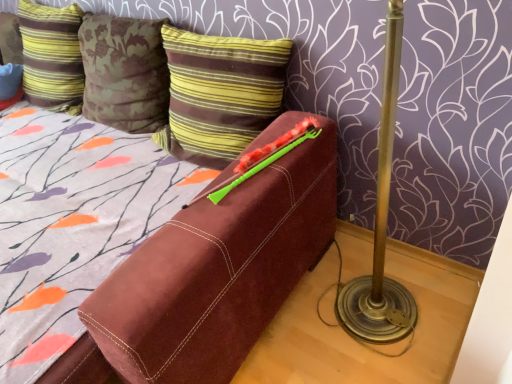
What do you see at coordinates (220, 94) in the screenshot? Image resolution: width=512 pixels, height=384 pixels. I see `brown striped pillow at upper center, the second pillow in the left-to-right sequence` at bounding box center [220, 94].

You are a GUI agent. You are given a task and a screenshot of the screen. Output one action in this format:
    pyautogui.click(x=<x>, y=<y>)
    Task: Click on the green plastic crayon at upper center
    The width and height of the screenshot is (512, 384).
    Given the screenshot: What is the action you would take?
    tap(268, 155)

How different are the orientations of brown striped pillow at upper center, which is the first pillow from right to left, and striped velvet pillow at upper left, which is the second pillow from right to left, in degrees?

The angular difference between brown striped pillow at upper center, which is the first pillow from right to left, and striped velvet pillow at upper left, which is the second pillow from right to left, is 0.000268 degrees.

Is brown striped pillow at upper center, the second pillow in the left-to-right sequence, in front of or behind striped velvet pillow at upper left, which is the second pillow from right to left, in the image?

Clearly, brown striped pillow at upper center, the second pillow in the left-to-right sequence, is in front of striped velvet pillow at upper left, which is the second pillow from right to left.

Does brown striped pillow at upper center, the second pillow in the left-to-right sequence, have a larger size compared to striped velvet pillow at upper left, which is the second pillow from right to left?

Actually, brown striped pillow at upper center, the second pillow in the left-to-right sequence, might be smaller than striped velvet pillow at upper left, which is the second pillow from right to left.

How far apart are brown striped pillow at upper center, the second pillow in the left-to-right sequence, and striped velvet pillow at upper left, which ranks as the 1th pillow in left-to-right order?

They are 30.31 inches apart.

Considering their positions, is striped velvet pillow at upper left, which ranks as the 1th pillow in left-to-right order, located in front of or behind brown striped pillow at upper center, which is the first pillow from right to left?

In the image, striped velvet pillow at upper left, which ranks as the 1th pillow in left-to-right order, appears behind brown striped pillow at upper center, which is the first pillow from right to left.

Does striped velvet pillow at upper left, which ranks as the 1th pillow in left-to-right order, contain brown striped pillow at upper center, which is the first pillow from right to left?

No, brown striped pillow at upper center, which is the first pillow from right to left, is not inside striped velvet pillow at upper left, which ranks as the 1th pillow in left-to-right order.

From the image's perspective, is striped velvet pillow at upper left, which is the second pillow from right to left, above or below brown striped pillow at upper center, which is the first pillow from right to left?

Based on their image positions, striped velvet pillow at upper left, which is the second pillow from right to left, is located above brown striped pillow at upper center, which is the first pillow from right to left.

Looking at this image, from the image's perspective, relative to brown striped pillow at upper center, which is the first pillow from right to left, is green plastic crayon at upper center above or below?

Clearly, from the image's perspective, green plastic crayon at upper center is below brown striped pillow at upper center, which is the first pillow from right to left.

In the scene shown: Who is shorter, green plastic crayon at upper center or brown striped pillow at upper center, which is the first pillow from right to left?

green plastic crayon at upper center is shorter.

From a real-world perspective, is green plastic crayon at upper center physically above brown striped pillow at upper center, which is the first pillow from right to left?

No, from a real-world perspective, green plastic crayon at upper center is not above brown striped pillow at upper center, which is the first pillow from right to left.

Considering the positions of objects green plastic crayon at upper center and brown striped pillow at upper center, which is the first pillow from right to left, in the image provided, who is more to the left, green plastic crayon at upper center or brown striped pillow at upper center, which is the first pillow from right to left,?

Positioned to the left is brown striped pillow at upper center, which is the first pillow from right to left.

Is brown striped pillow at upper center, which is the first pillow from right to left, situated inside green plastic crayon at upper center or outside?

brown striped pillow at upper center, which is the first pillow from right to left, is located beyond the bounds of green plastic crayon at upper center.

Considering the sizes of brown striped pillow at upper center, the second pillow in the left-to-right sequence, and green plastic crayon at upper center in the image, is brown striped pillow at upper center, the second pillow in the left-to-right sequence, bigger or smaller than green plastic crayon at upper center?

brown striped pillow at upper center, the second pillow in the left-to-right sequence, is bigger than green plastic crayon at upper center.

Is brown striped pillow at upper center, the second pillow in the left-to-right sequence, next to green plastic crayon at upper center?

No, brown striped pillow at upper center, the second pillow in the left-to-right sequence, is not making contact with green plastic crayon at upper center.

Does green plastic crayon at upper center have a greater width compared to striped velvet pillow at upper left, which is the second pillow from right to left?

Yes.

Are green plastic crayon at upper center and striped velvet pillow at upper left, which is the second pillow from right to left, beside each other?

No, green plastic crayon at upper center is not touching striped velvet pillow at upper left, which is the second pillow from right to left.

Does point (287, 151) lie in front of point (81, 67)?

Yes, point (287, 151) is in front of point (81, 67).

From a real-world perspective, is green plastic crayon at upper center above or below striped velvet pillow at upper left, which is the second pillow from right to left?

From a real-world perspective, green plastic crayon at upper center is physically below striped velvet pillow at upper left, which is the second pillow from right to left.

From a real-world perspective, is striped velvet pillow at upper left, which is the second pillow from right to left, located beneath green plastic crayon at upper center?

No, from a real-world perspective, striped velvet pillow at upper left, which is the second pillow from right to left, is not beneath green plastic crayon at upper center.

Consider the image. Does striped velvet pillow at upper left, which is the second pillow from right to left, have a lesser width compared to green plastic crayon at upper center?

Indeed, striped velvet pillow at upper left, which is the second pillow from right to left, has a lesser width compared to green plastic crayon at upper center.

Is striped velvet pillow at upper left, which is the second pillow from right to left, closer to the viewer compared to green plastic crayon at upper center?

No, striped velvet pillow at upper left, which is the second pillow from right to left, is further to the viewer.

Locate an element on the screen. The width and height of the screenshot is (512, 384). pillow behind the brown striped pillow at upper center, which is the first pillow from right to left is located at coordinates (52, 56).

At what (x,y) coordinates should I click in order to perform the action: click on pillow below the striped velvet pillow at upper left, which ranks as the 1th pillow in left-to-right order (from the image's perspective). Please return your answer as a coordinate pair (x, y). Looking at the image, I should click on (220, 94).

Based on their spatial positions, is green plastic crayon at upper center or striped velvet pillow at upper left, which ranks as the 1th pillow in left-to-right order, closer to brown striped pillow at upper center, which is the first pillow from right to left?

Among the two, green plastic crayon at upper center is located nearer to brown striped pillow at upper center, which is the first pillow from right to left.

Based on their spatial positions, is brown striped pillow at upper center, the second pillow in the left-to-right sequence, or striped velvet pillow at upper left, which is the second pillow from right to left, closer to green plastic crayon at upper center?

brown striped pillow at upper center, the second pillow in the left-to-right sequence, is closer to green plastic crayon at upper center.

When comparing their distances from brown striped pillow at upper center, which is the first pillow from right to left, does striped velvet pillow at upper left, which is the second pillow from right to left, or green plastic crayon at upper center seem further?

striped velvet pillow at upper left, which is the second pillow from right to left.

When comparing their distances from striped velvet pillow at upper left, which ranks as the 1th pillow in left-to-right order, does brown striped pillow at upper center, the second pillow in the left-to-right sequence, or green plastic crayon at upper center seem further?

green plastic crayon at upper center.

Looking at the image, which one is located further to green plastic crayon at upper center, striped velvet pillow at upper left, which ranks as the 1th pillow in left-to-right order, or brown striped pillow at upper center, which is the first pillow from right to left?

striped velvet pillow at upper left, which ranks as the 1th pillow in left-to-right order, is positioned further to the anchor green plastic crayon at upper center.

When comparing their distances from striped velvet pillow at upper left, which ranks as the 1th pillow in left-to-right order, does green plastic crayon at upper center or brown striped pillow at upper center, which is the first pillow from right to left, seem further?

green plastic crayon at upper center lies further to striped velvet pillow at upper left, which ranks as the 1th pillow in left-to-right order, than the other object.

Locate an element on the screen. The height and width of the screenshot is (384, 512). pillow between striped velvet pillow at upper left, which is the second pillow from right to left, and green plastic crayon at upper center, in the horizontal direction is located at coordinates (220, 94).